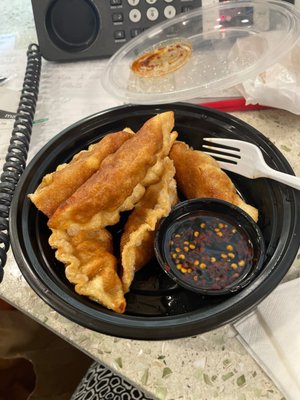
This screenshot has height=400, width=300. Identify the location of top napkin to wipe the mouth after eating. (285, 328).